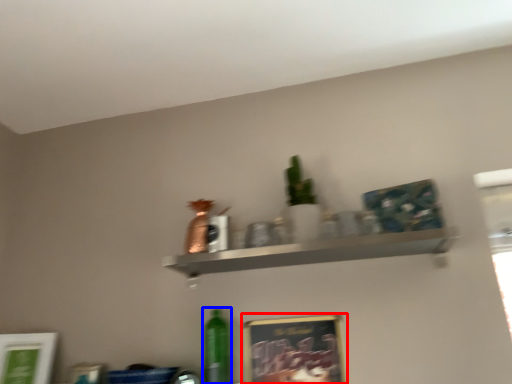
Question: Which object appears farthest to the camera in this image, picture frame (highlighted by a red box) or bottle (highlighted by a blue box)?

Choices:
 (A) picture frame
 (B) bottle

Answer: (B)